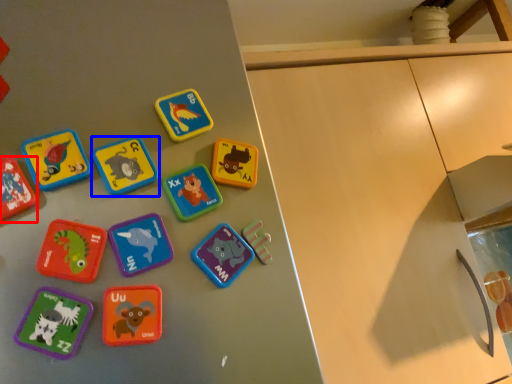
Question: Which object appears farthest to the camera in this image, toy (highlighted by a red box) or toy (highlighted by a blue box)?

Choices:
 (A) toy
 (B) toy

Answer: (B)